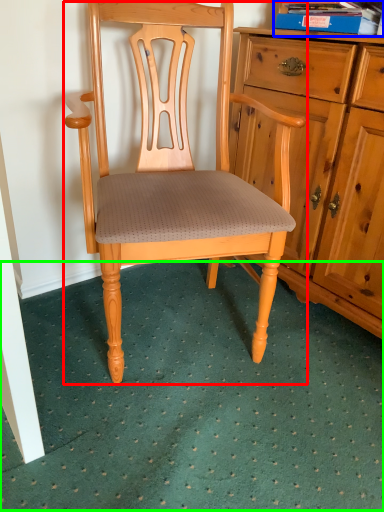
Question: Based on their relative distances, which object is farther from chair (highlighted by a red box)? Choose from book (highlighted by a blue box) and doormat (highlighted by a green box).

Choices:
 (A) book
 (B) doormat

Answer: (A)